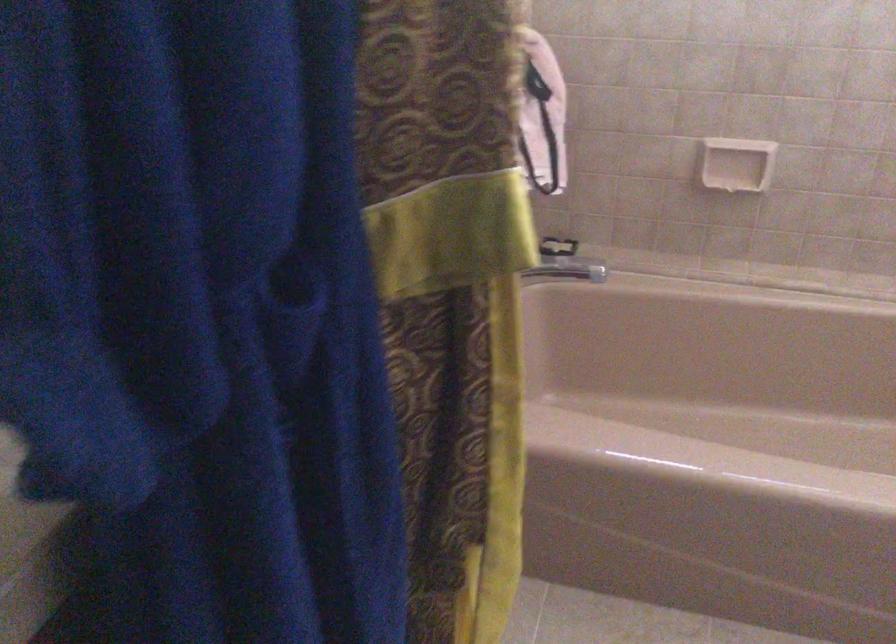
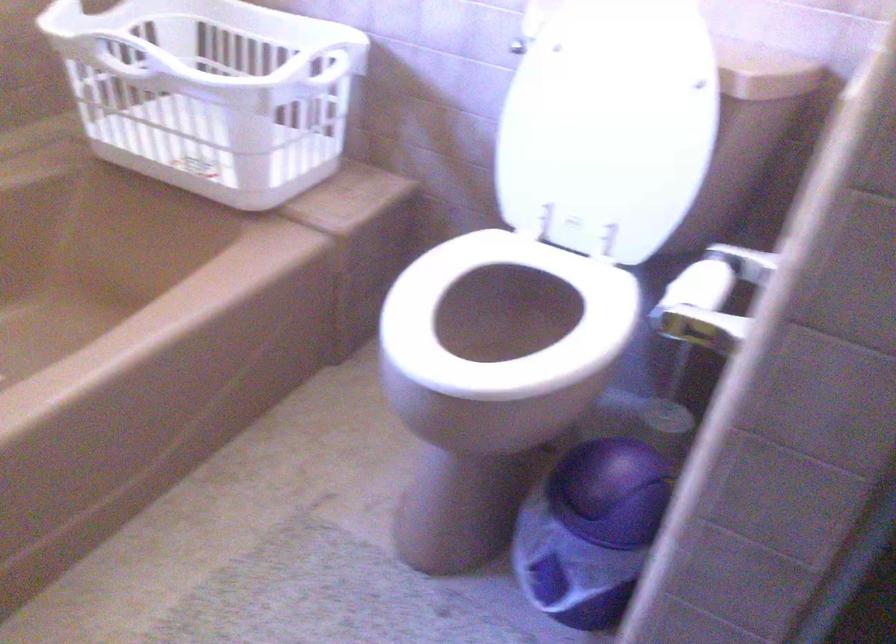
The first image is from the beginning of the video and the second image is from the end. How did the camera likely rotate when shooting the video?

The camera's rotation is toward right-down.